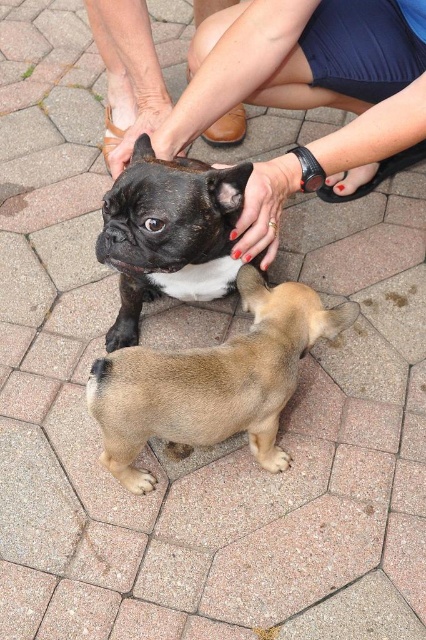
Does point (129, 241) come behind point (120, 321)?

No, (129, 241) is in front of (120, 321).

Which is above, shiny black fur at center or black matte paw at lower left?

shiny black fur at center is above.

Who is more distant from viewer, (221, 221) or (115, 324)?

The point (115, 324) is more distant.

The image size is (426, 640). What are the coordinates of `shiny black fur at center` in the screenshot? It's located at (170, 228).

Is smooth black dog at center smaller than shiny black fur at center?

Actually, smooth black dog at center might be larger than shiny black fur at center.

Does smooth black dog at center lie behind shiny black fur at center?

Yes, smooth black dog at center is further from the viewer.

Between point (420, 58) and point (170, 212), which one is positioned in front?

Point (170, 212) is more forward.

This screenshot has width=426, height=640. Identify the location of smooth black dog at center. (305, 93).

Can you confirm if smooth black dog at center is positioned below smooth tan dog at center?

No.

Between smooth black dog at center and smooth tan dog at center, which one has less height?

smooth tan dog at center is shorter.

Is point (367, 83) positioned before point (275, 448)?

No, (367, 83) is behind (275, 448).

The height and width of the screenshot is (640, 426). In order to click on smooth black dog at center in this screenshot , I will do `click(305, 93)`.